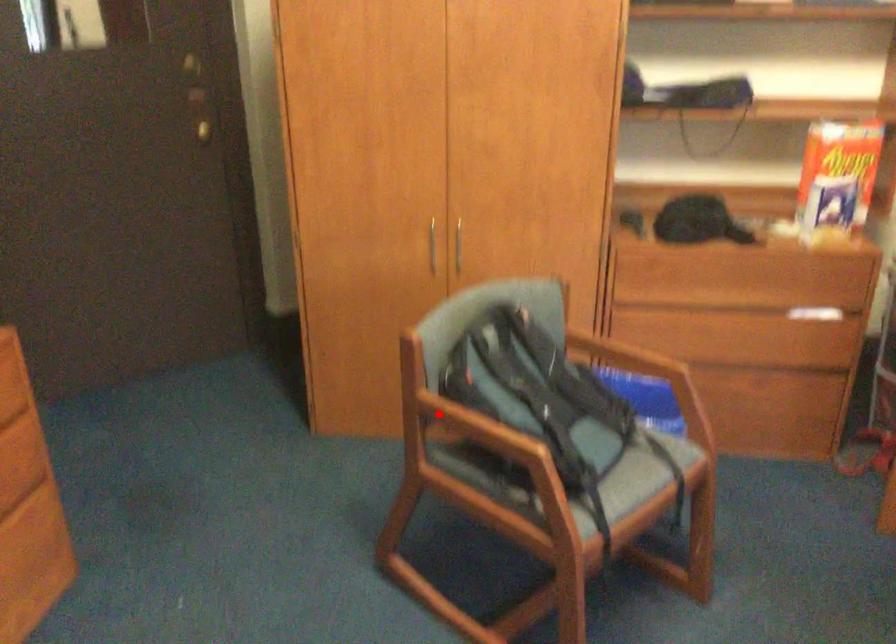
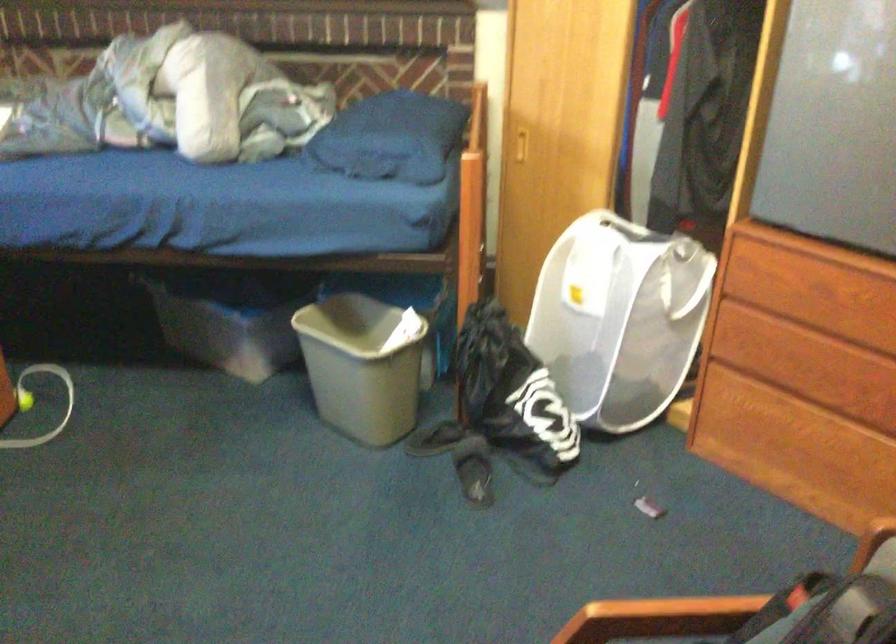
Question: A red point is marked in image1. In image2, is the corresponding 3D point closer to the camera or farther? Reply with the corresponding letter.

Choices:
 (A) The corresponding 3D point is closer.
 (B) The corresponding 3D point is farther.

Answer: (A)